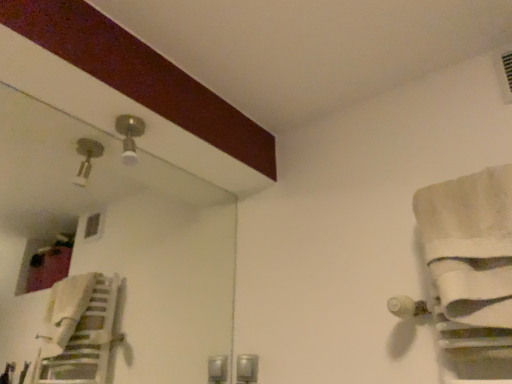
Question: Is the position of white cotton bath towel at right less distant than that of matte silver light fixture at upper center?

Choices:
 (A) no
 (B) yes

Answer: (B)

Question: Is matte silver light fixture at upper center located within white cotton bath towel at right?

Choices:
 (A) yes
 (B) no

Answer: (B)

Question: Is white cotton bath towel at right taller than matte silver light fixture at upper center?

Choices:
 (A) no
 (B) yes

Answer: (B)

Question: Considering the relative sizes of white cotton bath towel at right and matte silver light fixture at upper center in the image provided, is white cotton bath towel at right smaller than matte silver light fixture at upper center?

Choices:
 (A) yes
 (B) no

Answer: (B)

Question: Is white cotton bath towel at right beside matte silver light fixture at upper center?

Choices:
 (A) no
 (B) yes

Answer: (A)

Question: From a real-world perspective, is white cotton bath towel at right located higher than matte silver light fixture at upper center?

Choices:
 (A) yes
 (B) no

Answer: (B)

Question: Is matte silver light fixture at upper center shorter than white cotton bath towel at right?

Choices:
 (A) yes
 (B) no

Answer: (A)

Question: Does matte silver light fixture at upper center have a greater width compared to white cotton bath towel at right?

Choices:
 (A) yes
 (B) no

Answer: (B)

Question: Is the surface of matte silver light fixture at upper center in direct contact with white cotton bath towel at right?

Choices:
 (A) yes
 (B) no

Answer: (B)

Question: From a real-world perspective, is matte silver light fixture at upper center located higher than white cotton bath towel at right?

Choices:
 (A) no
 (B) yes

Answer: (B)

Question: Is matte silver light fixture at upper center closer to camera compared to white cotton bath towel at right?

Choices:
 (A) yes
 (B) no

Answer: (B)

Question: Is matte silver light fixture at upper center at the left side of white cotton bath towel at right?

Choices:
 (A) no
 (B) yes

Answer: (B)

Question: From a real-world perspective, is matte silver light fixture at upper center physically located above or below white cotton bath towel at right?

Choices:
 (A) above
 (B) below

Answer: (A)